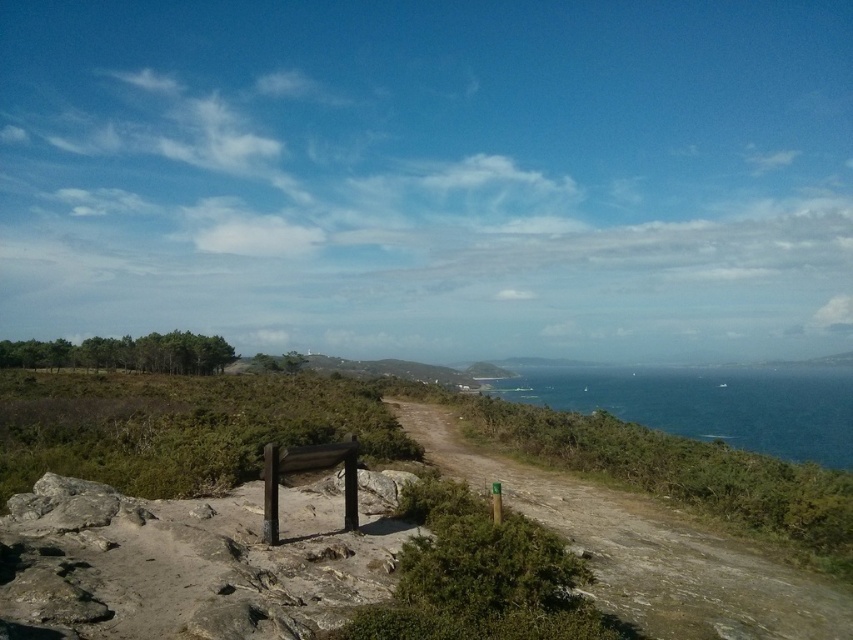
You are a hiker planning to follow the dirt path at center to reach the ocean. Based on the scene description, can you determine the direction the path leads towards the ocean?

The dirt path at center is located at point (646, 548), which is towards the lower part of the image. Since the ocean is at the horizon where the path leads, the path leads towards the ocean in the lower direction from its current position.

You are a hiker planning to walk along the dirt path at center towards the blue glossy water at right. Based on the scene, will the path be visible above or below the water level when you reach the water?

The dirt path at center is not as tall as blue glossy water at right, so the path will be below the water level when you reach the water.